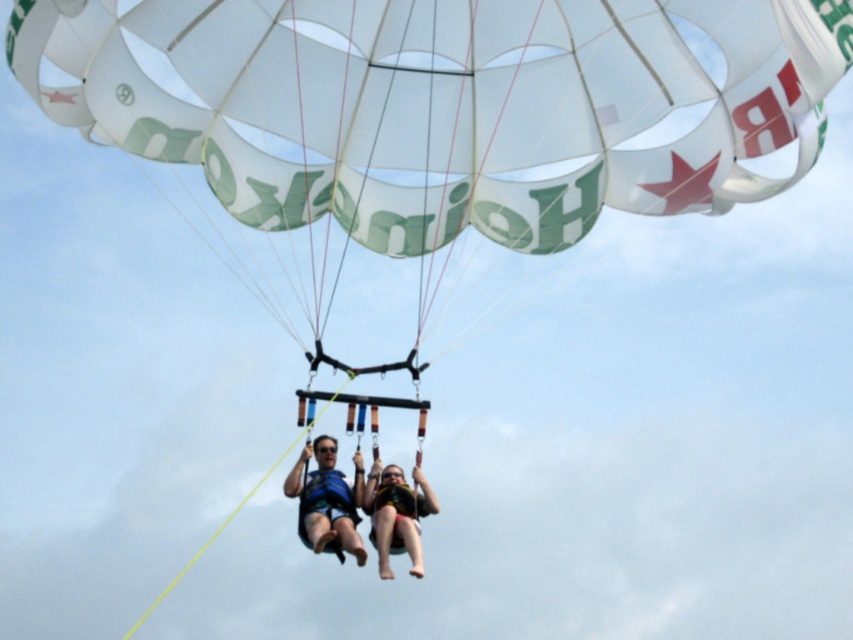
You are a photographer standing on the beach and want to take a photo of the black life vest at center and the blue life vest at center. Which one will appear closer to you in the photo?

The black life vest at center will appear closer to you in the photo because it is positioned closer to the viewer than the blue life vest at center.

You are a lifeguard observing two people parasailing. You notice a blue life vest at center and a matte yellow life vest at center. Which life vest is positioned higher on the harness?

The blue life vest at center is above the matte yellow life vest at center, so the blue one is higher.